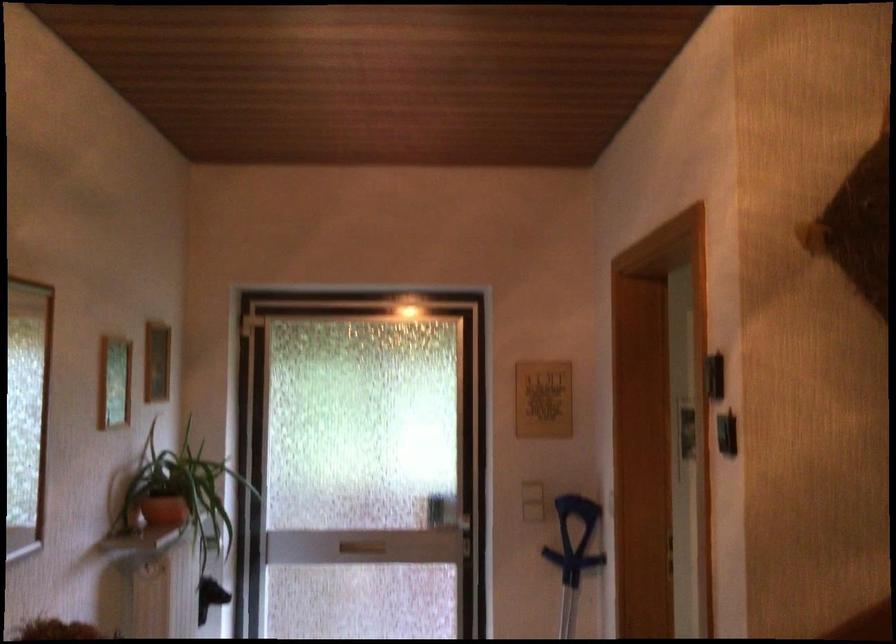
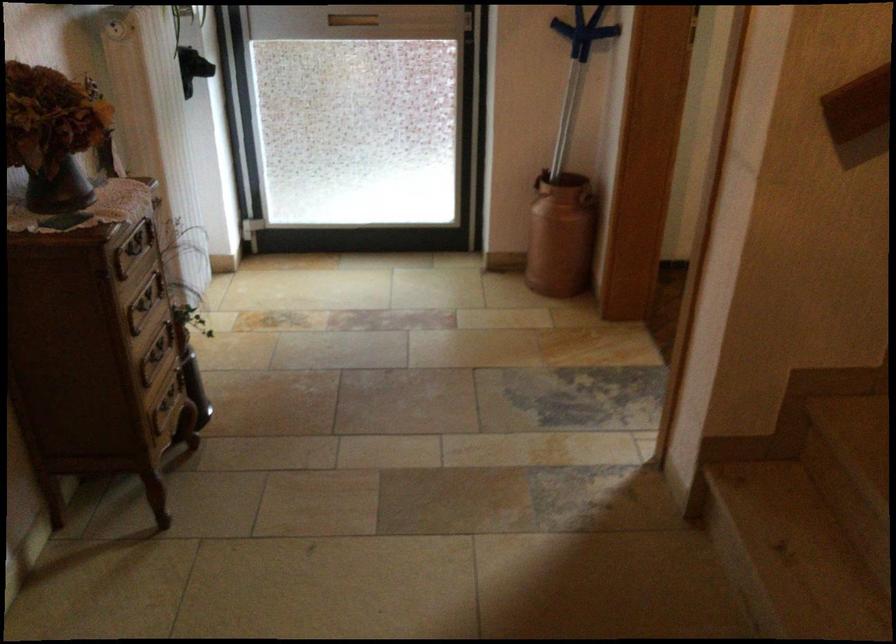
Locate, in the second image, the point that corresponds to (366,547) in the first image.

(352, 20)